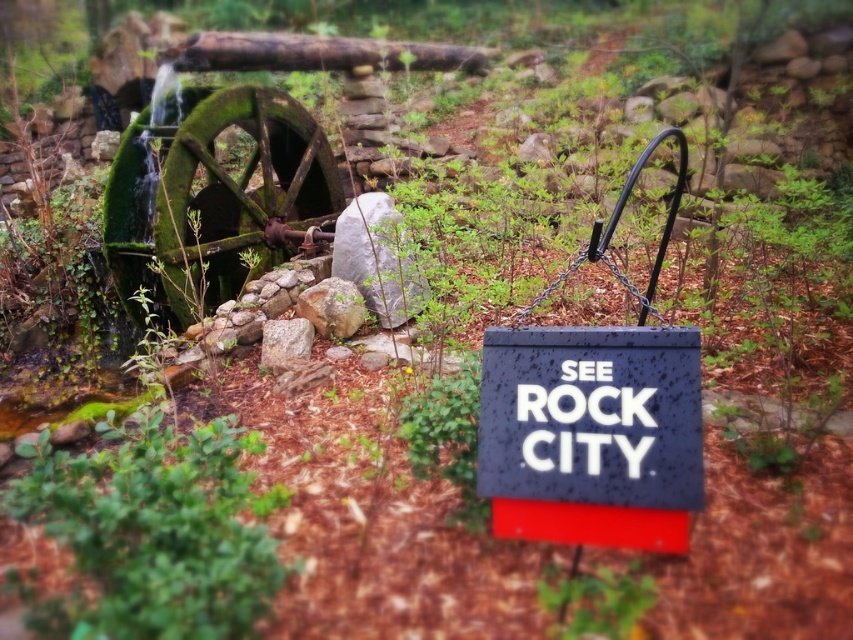
Between black textured sign at center and smooth brown log at upper center, which one has less height?

With less height is black textured sign at center.

Which of these two, black textured sign at center or smooth brown log at upper center, stands taller?

Standing taller between the two is smooth brown log at upper center.

Is point (642, 385) more distant than point (334, 40)?

That is False.

Find the location of a particular element. The height and width of the screenshot is (640, 853). black textured sign at center is located at coordinates (590, 435).